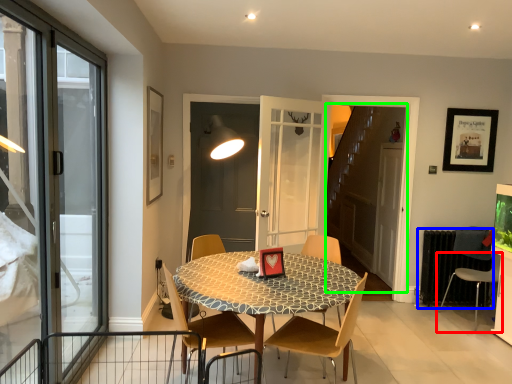
Question: Based on their relative distances, which object is nearer to chair (highlighted by a red box)? Choose from radiator (highlighted by a blue box) and elevator (highlighted by a green box).

Choices:
 (A) radiator
 (B) elevator

Answer: (A)